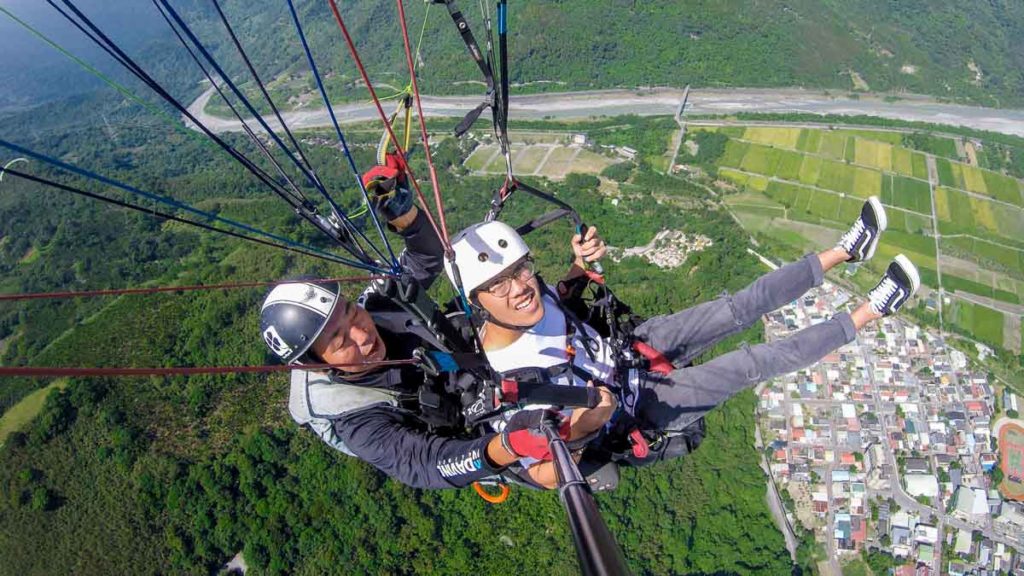
You are a GUI agent. You are given a task and a screenshot of the screen. Output one action in this format:
    pyautogui.click(x=<x>, y=<y>)
    Task: Click on the shoe
    
    Given the screenshot: What is the action you would take?
    pyautogui.click(x=855, y=241), pyautogui.click(x=899, y=306)